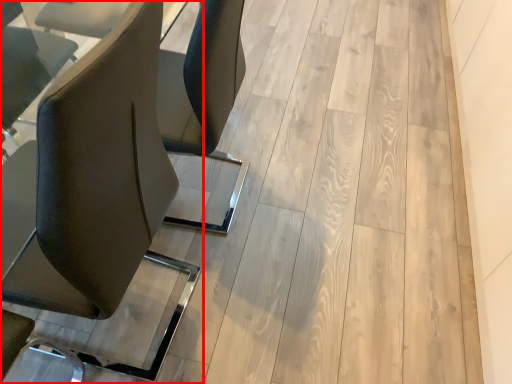
Question: Where is chair (annotated by the red box) located in relation to plywood in the image?

Choices:
 (A) right
 (B) left

Answer: (B)